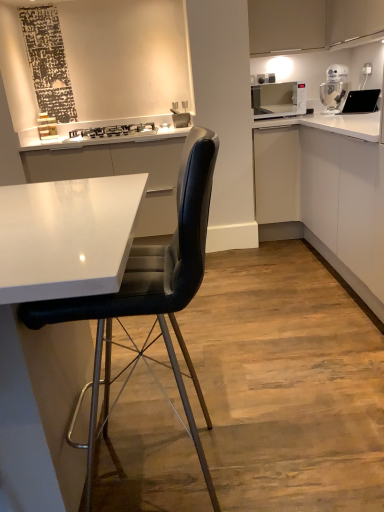
What is the approximate width of black leather chair at center?

black leather chair at center is 21.12 inches wide.

This screenshot has height=512, width=384. Describe the element at coordinates (310, 23) in the screenshot. I see `matte white cabinet at upper right, the third cabinetry when ordered from bottom to top` at that location.

Identify the location of white glossy stand mixer at upper right. Image resolution: width=384 pixels, height=512 pixels. (335, 87).

What do you see at coordinates (335, 87) in the screenshot? This screenshot has height=512, width=384. I see `white glossy stand mixer at upper right` at bounding box center [335, 87].

Image resolution: width=384 pixels, height=512 pixels. I want to click on white matte cabinet at center-right, the second cabinetry when ordered from bottom to top, so click(x=277, y=174).

I want to click on white glossy cabinet at right, the 1th cabinetry positioned from the bottom, so click(326, 193).

Identify the location of white glossy microwave at upper right. (278, 99).

What is the approximate height of black glass stove at upper center?

It is 3.11 inches.

Image resolution: width=384 pixels, height=512 pixels. I want to click on black leather chair at center, so click(x=150, y=294).

Based on the photo, considering the sizes of black glossy sink at upper right and white glossy microwave at upper right in the image, is black glossy sink at upper right taller or shorter than white glossy microwave at upper right?

black glossy sink at upper right is shorter than white glossy microwave at upper right.

Which of these two, black glossy sink at upper right or white glossy microwave at upper right, is bigger?

Bigger between the two is white glossy microwave at upper right.

Based on the photo, is black glossy sink at upper right far away from white glossy microwave at upper right?

No.

Which object is more forward, black glossy sink at upper right or white glossy microwave at upper right?

black glossy sink at upper right is more forward.

Considering the relative sizes of white glossy stand mixer at upper right and white glossy microwave at upper right in the image provided, is white glossy stand mixer at upper right wider than white glossy microwave at upper right?

Incorrect, the width of white glossy stand mixer at upper right does not surpass that of white glossy microwave at upper right.

Find the location of a particular element. home appliance on the left of white glossy stand mixer at upper right is located at coordinates (278, 99).

Can you see white glossy stand mixer at upper right touching white glossy microwave at upper right?

No, white glossy stand mixer at upper right is not making contact with white glossy microwave at upper right.

What's the angular difference between white glossy stand mixer at upper right and white glossy microwave at upper right's facing directions?

The facing directions of white glossy stand mixer at upper right and white glossy microwave at upper right are 33.6 degrees apart.

From the image's perspective, is white glossy stand mixer at upper right above or below matte white cabinet at upper right, the third cabinetry when ordered from bottom to top?

white glossy stand mixer at upper right is situated lower than matte white cabinet at upper right, the third cabinetry when ordered from bottom to top, in the image.

What's the angular difference between white glossy stand mixer at upper right and matte white cabinet at upper right, the third cabinetry when ordered from bottom to top,'s facing directions?

They differ by 56.5 degrees in their facing directions.

Are white glossy stand mixer at upper right and matte white cabinet at upper right, which is the first cabinetry in top-to-bottom order, making contact?

white glossy stand mixer at upper right and matte white cabinet at upper right, which is the first cabinetry in top-to-bottom order, are clearly separated.

Considering the positions of point (329, 85) and point (268, 52), is point (329, 85) closer or farther from the camera than point (268, 52)?

Point (329, 85).

Which object is closer to the camera taking this photo, white glossy cabinet at right, the 1th cabinetry positioned from the bottom, or white glossy stand mixer at upper right?

white glossy cabinet at right, the 1th cabinetry positioned from the bottom, is closer to the camera.

From the image's perspective, who appears lower, white glossy cabinet at right, marked as the third cabinetry in a top-to-bottom arrangement, or white glossy stand mixer at upper right?

From the image's view, white glossy cabinet at right, marked as the third cabinetry in a top-to-bottom arrangement, is below.

Would you consider white glossy cabinet at right, the 1th cabinetry positioned from the bottom, to be distant from white glossy stand mixer at upper right?

No, white glossy cabinet at right, the 1th cabinetry positioned from the bottom, is not far from white glossy stand mixer at upper right.

Is white glossy cabinet at right, the 1th cabinetry positioned from the bottom, turned away from white glossy stand mixer at upper right?

No, white glossy cabinet at right, the 1th cabinetry positioned from the bottom,'s orientation is not away from white glossy stand mixer at upper right.

Looking at this image, is black glass stove at upper center far away from white glossy stand mixer at upper right?

Yes, black glass stove at upper center and white glossy stand mixer at upper right are quite far apart.

Which object is positioned more to the left, black glass stove at upper center or white glossy stand mixer at upper right?

black glass stove at upper center.

From a real-world perspective, is black glass stove at upper center under white glossy stand mixer at upper right?

Yes, from a real-world perspective, black glass stove at upper center is beneath white glossy stand mixer at upper right.

What's the angular difference between black glass stove at upper center and white glossy stand mixer at upper right's facing directions?

The facing directions of black glass stove at upper center and white glossy stand mixer at upper right are 33.7 degrees apart.

Is black glass stove at upper center far from matte white cabinet at upper right, the third cabinetry when ordered from bottom to top?

Yes, black glass stove at upper center and matte white cabinet at upper right, the third cabinetry when ordered from bottom to top, are located far from each other.

Find the location of a particular element. The height and width of the screenshot is (512, 384). cabinetry above the black glass stove at upper center (from the image's perspective) is located at coordinates (310, 23).

Considering the positions of objects black glass stove at upper center and matte white cabinet at upper right, which is the first cabinetry in top-to-bottom order, in the image provided, who is more to the right, black glass stove at upper center or matte white cabinet at upper right, which is the first cabinetry in top-to-bottom order,?

matte white cabinet at upper right, which is the first cabinetry in top-to-bottom order.

Looking at their sizes, would you say black glass stove at upper center is wider or thinner than matte white cabinet at upper right, which is the first cabinetry in top-to-bottom order?

Considering their sizes, black glass stove at upper center looks slimmer than matte white cabinet at upper right, which is the first cabinetry in top-to-bottom order.

Is white glossy microwave at upper right at the left side of white glossy stand mixer at upper right?

Yes, white glossy microwave at upper right is to the left of white glossy stand mixer at upper right.

From the image's perspective, is white glossy microwave at upper right above white glossy stand mixer at upper right?

No, from the image's perspective, white glossy microwave at upper right is not over white glossy stand mixer at upper right.

Is white glossy microwave at upper right placed right next to white glossy stand mixer at upper right?

No.

At what (x,y) coordinates should I click in order to perform the action: click on home appliance on the left of black glossy sink at upper right. Please return your answer as a coordinate pair (x, y). Image resolution: width=384 pixels, height=512 pixels. Looking at the image, I should click on (278, 99).

Locate an element on the screen. The image size is (384, 512). kitchen appliance that is above the white glossy microwave at upper right (from a real-world perspective) is located at coordinates (335, 87).

Looking at the image, which one is located closer to black glass stove at upper center, matte white cabinet at upper right, which is the first cabinetry in top-to-bottom order, or white glossy stand mixer at upper right?

matte white cabinet at upper right, which is the first cabinetry in top-to-bottom order.

Estimate the real-world distances between objects in this image. Which object is closer to black glass stove at upper center, black leather chair at center or matte white cabinet at upper right, the third cabinetry when ordered from bottom to top?

matte white cabinet at upper right, the third cabinetry when ordered from bottom to top, lies closer to black glass stove at upper center than the other object.

When comparing their distances from matte white cabinet at upper right, which is the first cabinetry in top-to-bottom order, does black leather chair at center or black glossy sink at upper right seem further?

black leather chair at center is further to matte white cabinet at upper right, which is the first cabinetry in top-to-bottom order.

Estimate the real-world distances between objects in this image. Which object is further from black leather chair at center, black glass stove at upper center or white matte cabinet at center-right, which appears as the 2th cabinetry when viewed from the top?

The object further to black leather chair at center is black glass stove at upper center.

From the image, which object appears to be nearer to white glossy microwave at upper right, white glossy stand mixer at upper right or matte white cabinet at upper right, the third cabinetry when ordered from bottom to top?

white glossy stand mixer at upper right.

Looking at the image, which one is located closer to white glossy stand mixer at upper right, white glossy cabinet at right, the 1th cabinetry positioned from the bottom, or black leather chair at center?

Based on the image, white glossy cabinet at right, the 1th cabinetry positioned from the bottom, appears to be nearer to white glossy stand mixer at upper right.

Estimate the real-world distances between objects in this image. Which object is further from matte white cabinet at upper right, the third cabinetry when ordered from bottom to top, black glass stove at upper center or white matte cabinet at center-right, the second cabinetry when ordered from bottom to top?

Based on the image, black glass stove at upper center appears to be further to matte white cabinet at upper right, the third cabinetry when ordered from bottom to top.

Which object lies further to the anchor point black leather chair at center, white glossy stand mixer at upper right or matte white cabinet at upper right, the third cabinetry when ordered from bottom to top?

white glossy stand mixer at upper right lies further to black leather chair at center than the other object.

In order to click on sink between white glossy cabinet at right, marked as the third cabinetry in a top-to-bottom arrangement, and white glossy microwave at upper right, along the z-axis in this screenshot , I will do `click(358, 102)`.

At what (x,y) coordinates should I click in order to perform the action: click on sink located between matte white cabinet at upper right, which is the first cabinetry in top-to-bottom order, and white glossy microwave at upper right in the depth direction. Please return your answer as a coordinate pair (x, y). The height and width of the screenshot is (512, 384). Looking at the image, I should click on (358, 102).

Find the location of `home appliance between black glass stove at upper center and white glossy stand mixer at upper right in the horizontal direction`. home appliance between black glass stove at upper center and white glossy stand mixer at upper right in the horizontal direction is located at coordinates (278, 99).

At what (x,y) coordinates should I click in order to perform the action: click on cabinetry between black glass stove at upper center and white glossy microwave at upper right in the horizontal direction. Please return your answer as a coordinate pair (x, y). Looking at the image, I should click on (277, 174).